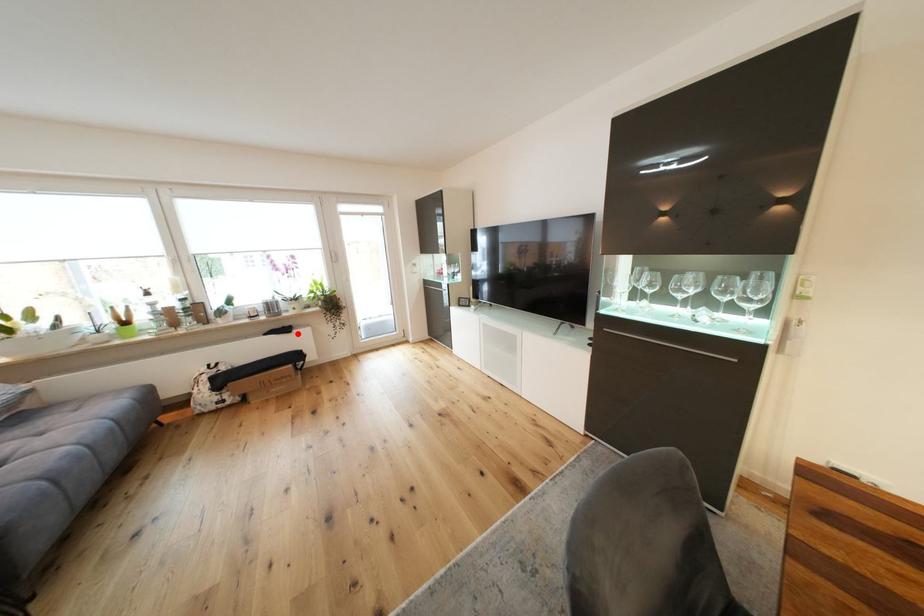
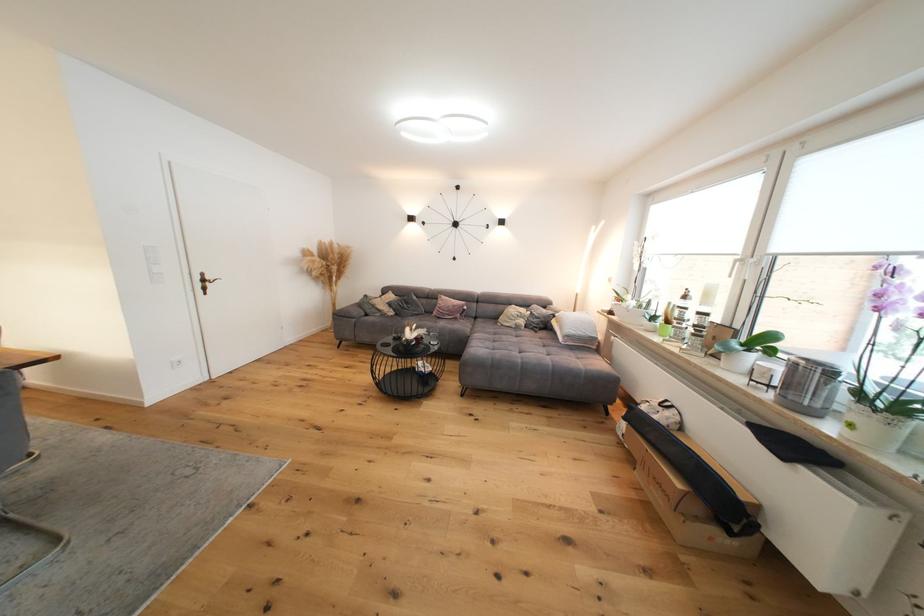
The point at the highlighted location is marked in the first image. Where is the corresponding point in the second image?

(793, 461)